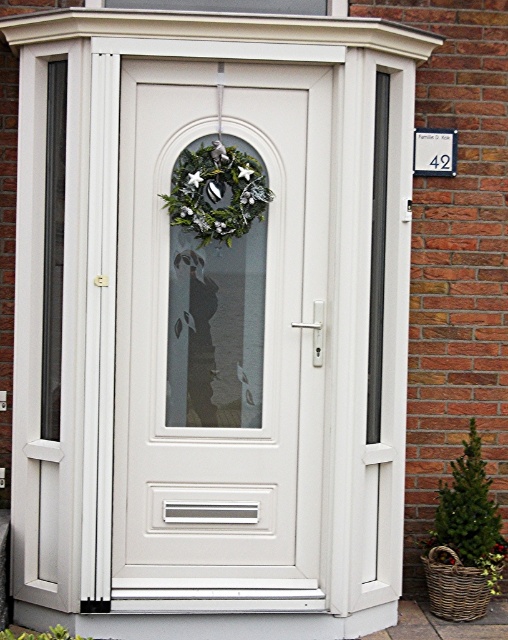
You are a delivery person trying to place a small package on the door. The package is 15 cm wide. The green matte wreath at center and transparent glass window at upper center are on the door. Which object can the package fit next to without overlapping?

The green matte wreath at center has a lesser width compared to the transparent glass window at upper center, so the package can fit next to the green matte wreath at center since it is narrower.

You are a delivery person trying to deliver a package to the address shown. The door has a handle and a keyhole. You need to know which part of the door is larger to determine where to place the package. Which is bigger, the white glossy door at center or the transparent glass window at upper center?

The white glossy door at center is bigger than the transparent glass window at upper center, so the package should be placed on the larger white glossy door at center.